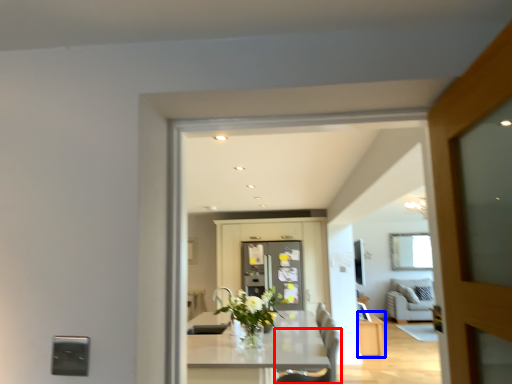
Question: Which point is closer to the camera, chair (highlighted by a red box) or cabinetry (highlighted by a blue box)?

Choices:
 (A) chair
 (B) cabinetry

Answer: (A)